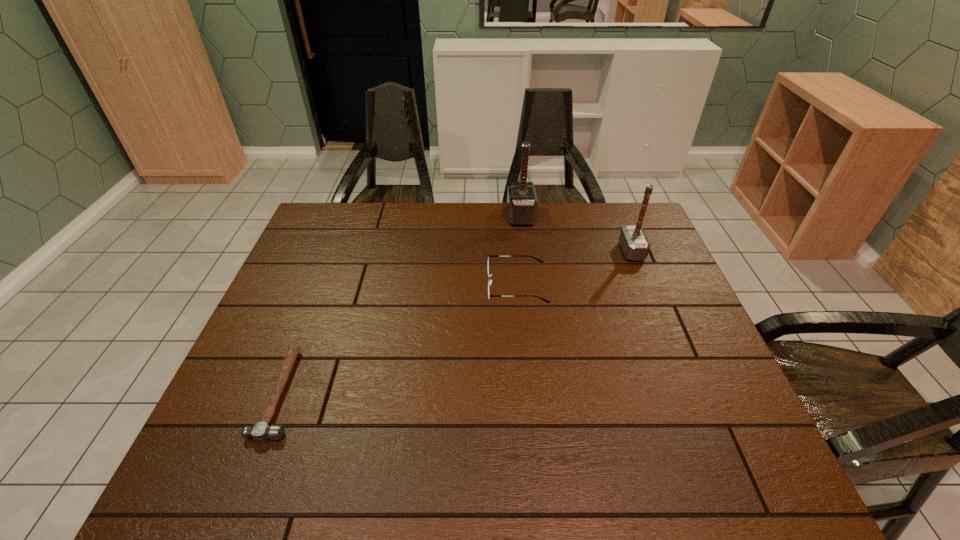
Identify the location of vacant space at the near edge. Image resolution: width=960 pixels, height=540 pixels. (482, 490).

In the image, there is a desktop. Find the location of `vacant region at the left edge`. vacant region at the left edge is located at coordinates (291, 266).

Where is `vacant area at the right edge of the desktop`? The image size is (960, 540). vacant area at the right edge of the desktop is located at coordinates (647, 271).

Where is `free region at the near right corner of the desktop`? free region at the near right corner of the desktop is located at coordinates (743, 453).

The width and height of the screenshot is (960, 540). I want to click on unoccupied position between the rightmost hammer and the second shortest object, so click(574, 268).

This screenshot has width=960, height=540. I want to click on free spot between the leftmost object and the second nearest object, so click(399, 339).

Image resolution: width=960 pixels, height=540 pixels. I want to click on vacant area that lies between the shortest object and the spectacles, so click(x=399, y=339).

The image size is (960, 540). What are the coordinates of `free space between the farthest object and the rightmost hammer` in the screenshot? It's located at (576, 233).

In order to click on vacant point located between the farthest hammer and the shortest hammer in this screenshot , I will do `click(401, 305)`.

This screenshot has width=960, height=540. Find the location of `unoccupied area between the rightmost object and the second hammer from right to left`. unoccupied area between the rightmost object and the second hammer from right to left is located at coordinates (576, 233).